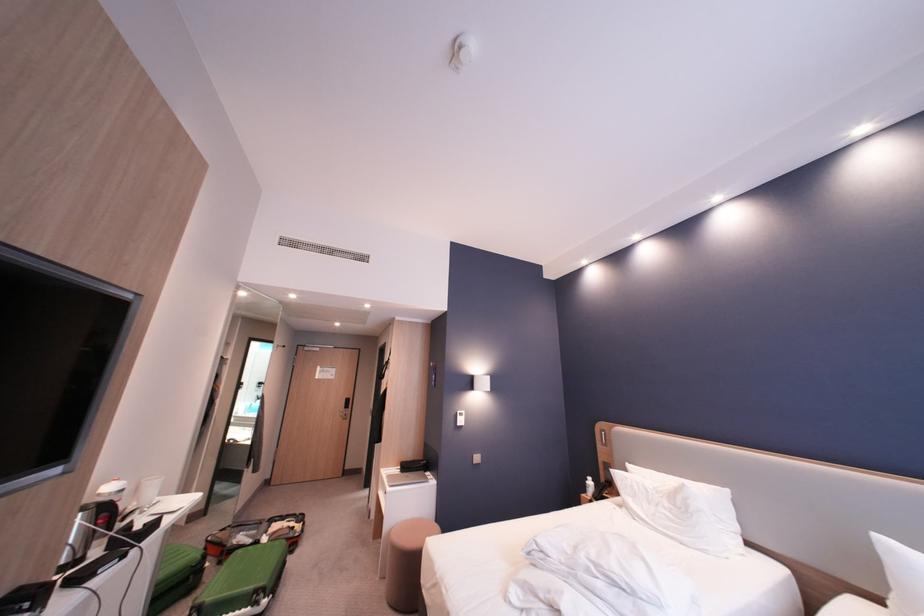
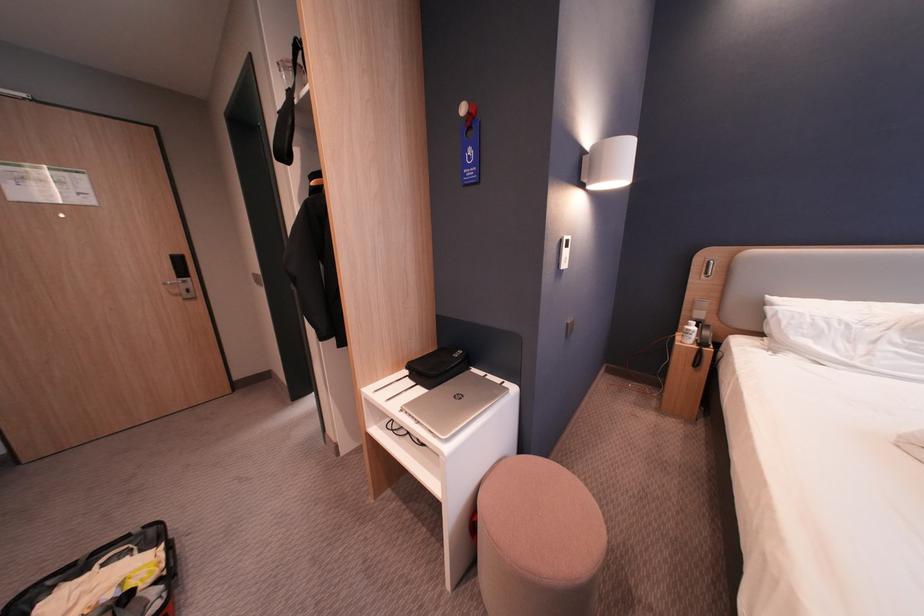
Where in the second image is the point corresponding to point 296,521 from the first image?

(99, 572)